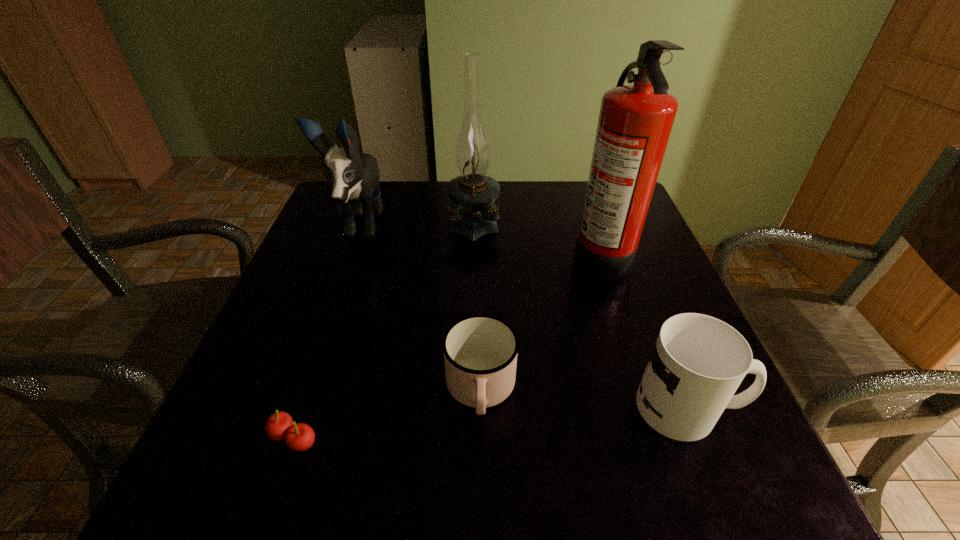
I want to click on blank region between the fourth tallest object and the puppy, so click(x=522, y=318).

The width and height of the screenshot is (960, 540). What are the coordinates of `unoccupied area between the shortest object and the puppy` in the screenshot? It's located at tap(326, 333).

Identify the location of free area in between the left mug and the cherry. (388, 414).

Image resolution: width=960 pixels, height=540 pixels. Find the location of `vacant point located between the tallest object and the right mug`. vacant point located between the tallest object and the right mug is located at coordinates (644, 330).

Where is `free space between the shortest object and the fifth tallest object`? free space between the shortest object and the fifth tallest object is located at coordinates (388, 414).

Locate an element on the screen. free space between the puppy and the second tallest object is located at coordinates (416, 224).

Find the location of `empty space between the oil lamp and the cherry`. empty space between the oil lamp and the cherry is located at coordinates (384, 329).

Where is `free point between the third shortest object and the second tallest object`? The image size is (960, 540). free point between the third shortest object and the second tallest object is located at coordinates (581, 314).

This screenshot has height=540, width=960. What are the coordinates of `vacant space that's between the left mug and the fifth shortest object` in the screenshot? It's located at (477, 305).

At what (x,y) coordinates should I click in order to perform the action: click on vacant space in between the oil lamp and the left mug. Please return your answer as a coordinate pair (x, y). Image resolution: width=960 pixels, height=540 pixels. Looking at the image, I should click on (477, 305).